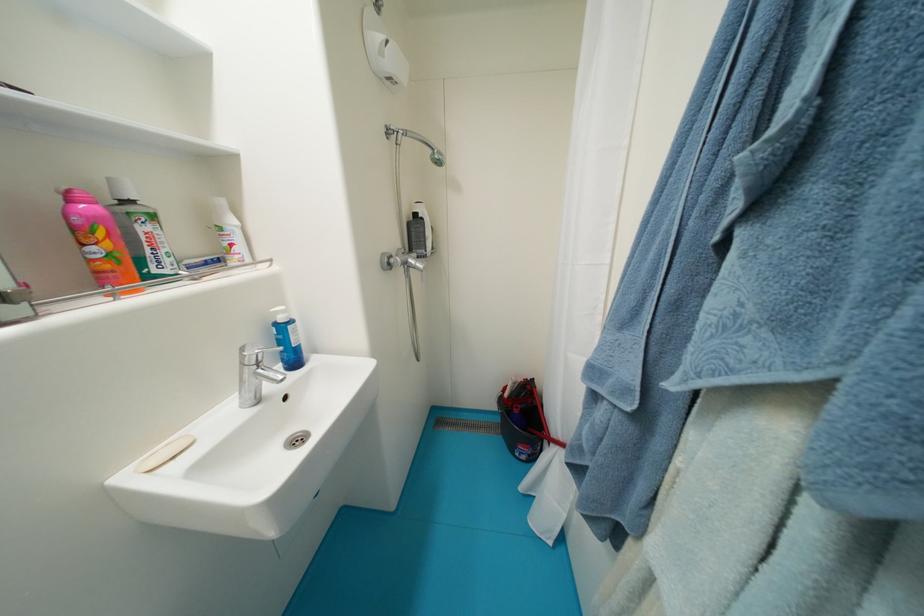
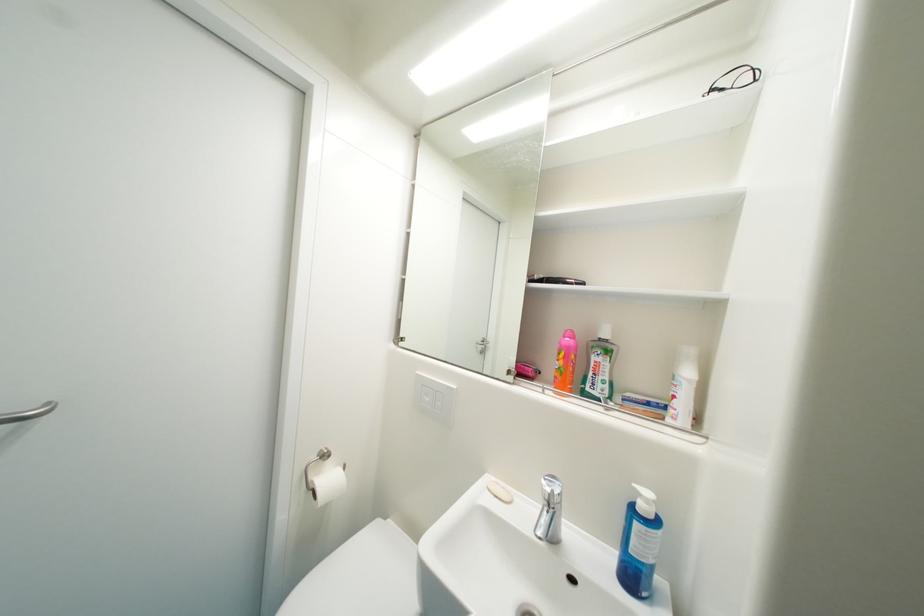
The point at (193, 264) is marked in the first image. Where is the corresponding point in the second image?

(635, 397)